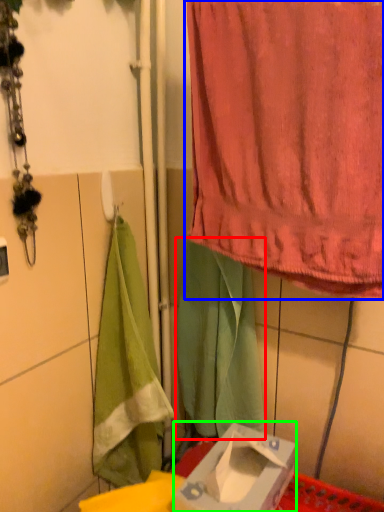
Question: Considering the real-world distances, which object is farthest from cloth (highlighted by a red box)? curtain (highlighted by a blue box) or box (highlighted by a green box)?

Choices:
 (A) curtain
 (B) box

Answer: (A)